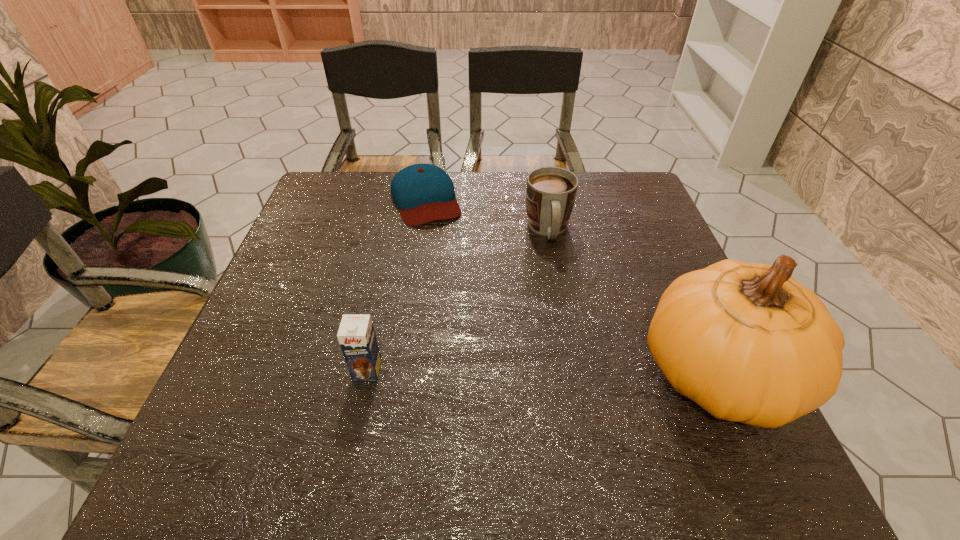
This screenshot has width=960, height=540. I want to click on vacant spot on the desktop that is between the chocolate milk and the pumpkin and is positioned on the side of the mug with the handle, so click(572, 373).

Identify the location of vacant space on the desktop that is between the chocolate milk and the tallest object and is positioned with the bill of the baseball cap facing forward. (496, 372).